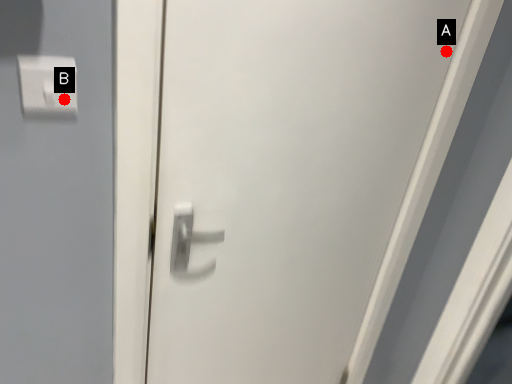
Question: Two points are circled on the image, labeled by A and B beside each circle. Which of the following is the farthest from the observer?

Choices:
 (A) A is further
 (B) B is further

Answer: (A)